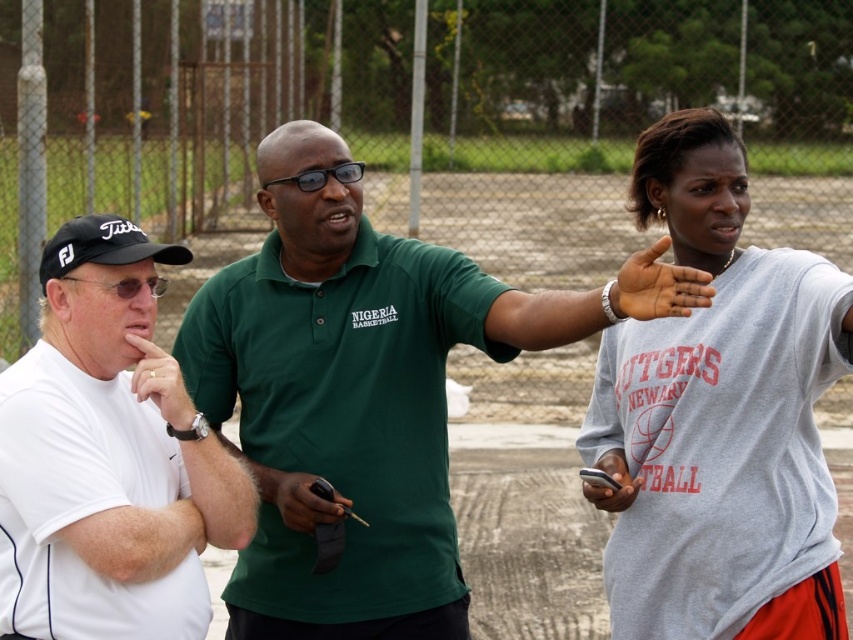
Question: Which object appears closest to the camera in this image?

Choices:
 (A) matte gray phone at center
 (B) gray cotton shirt at upper right
 (C) dark skin palm at center

Answer: (C)

Question: Can you confirm if gray cotton shirt at upper right is positioned to the right of white matte shirt at left?

Choices:
 (A) no
 (B) yes

Answer: (B)

Question: Considering the relative positions of green matte polo shirt at center and white matte shirt at left in the image provided, where is green matte polo shirt at center located with respect to white matte shirt at left?

Choices:
 (A) below
 (B) above

Answer: (B)

Question: Does gray cotton shirt at upper right have a smaller size compared to dark skin palm at center?

Choices:
 (A) no
 (B) yes

Answer: (A)

Question: Among these objects, which one is nearest to the camera?

Choices:
 (A) black matte pen at center
 (B) dark skin palm at center

Answer: (B)

Question: Which object is closer to the camera taking this photo?

Choices:
 (A) gold metallic ring at left
 (B) white matte shirt at left
 (C) black matte pen at center
 (D) gray cotton shirt at upper right

Answer: (B)